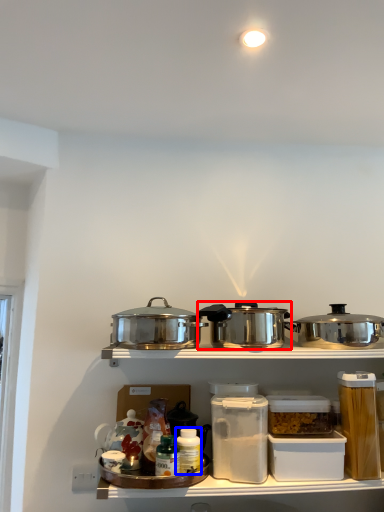
Question: Which point is further to the camera, kitchen appliance (highlighted by a red box) or bottle (highlighted by a blue box)?

Choices:
 (A) kitchen appliance
 (B) bottle

Answer: (B)